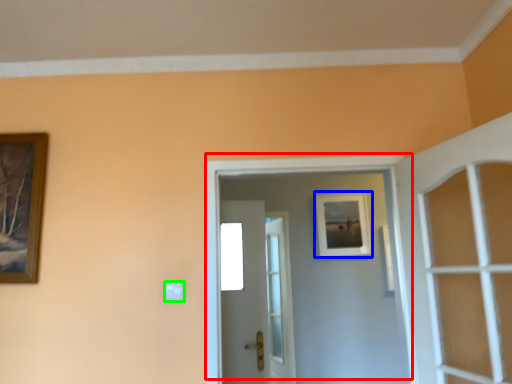
Question: Based on their relative distances, which object is nearer to door (highlighted by a red box)? Choose from picture frame (highlighted by a blue box) and light switch (highlighted by a green box).

Choices:
 (A) picture frame
 (B) light switch

Answer: (B)